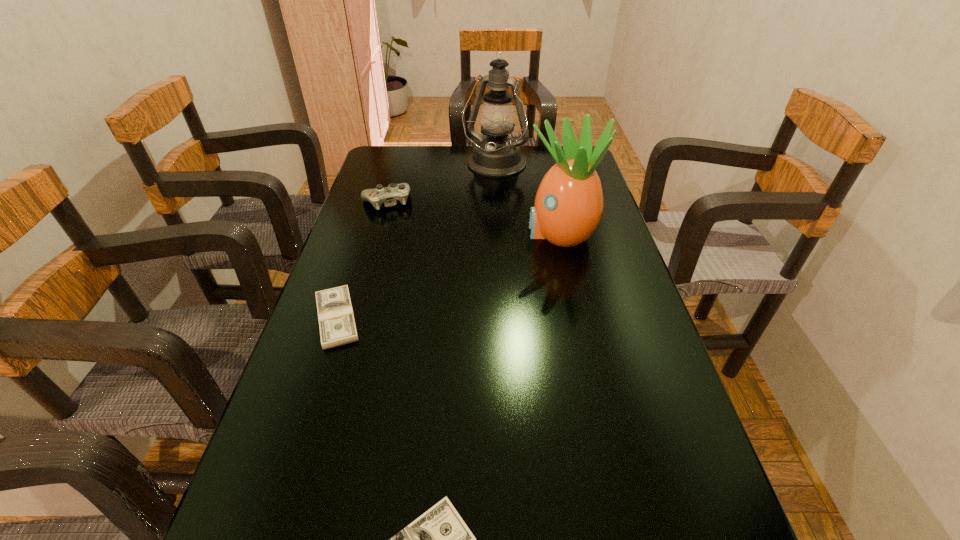
Find the location of `vacant point located between the oil lamp and the pineapple`. vacant point located between the oil lamp and the pineapple is located at coordinates (527, 199).

Locate an element on the screen. free space between the control and the pineapple is located at coordinates (473, 217).

Find the location of a particular element. This screenshot has width=960, height=540. vacant area that lies between the oil lamp and the pineapple is located at coordinates (527, 199).

The image size is (960, 540). I want to click on blank region between the pineapple and the farthest object, so click(527, 199).

This screenshot has height=540, width=960. What are the coordinates of `vacant space that is in between the pineapple and the farther dollar` in the screenshot? It's located at (448, 275).

The image size is (960, 540). I want to click on unoccupied area between the pineapple and the farthest object, so click(x=527, y=199).

Identify the location of the closest object relative to the left dollar. (439, 539).

Identify which object is the nearest to the pineapple. Please provide its 2D coordinates. Your answer should be formatted as a tuple, i.e. [(x, y)], where the tuple contains the x and y coordinates of a point satisfying the conditions above.

[(496, 155)]

Identify the location of vacant point that satisfies the following two spatial constraints: 1. at the entrance of the pineapple; 2. on the front side of the farther dollar. The height and width of the screenshot is (540, 960). (579, 319).